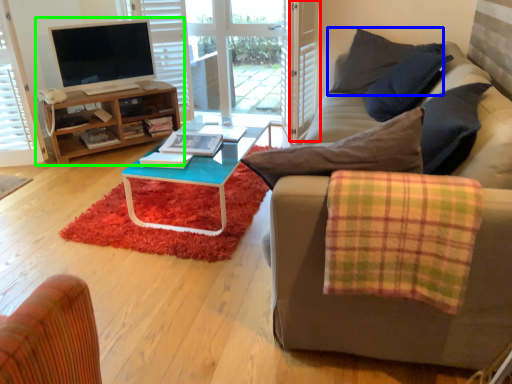
Question: Which is nearer to the screen door (highlighted by a red box)? pillow (highlighted by a blue box) or entertainment center (highlighted by a green box).

Choices:
 (A) pillow
 (B) entertainment center

Answer: (A)